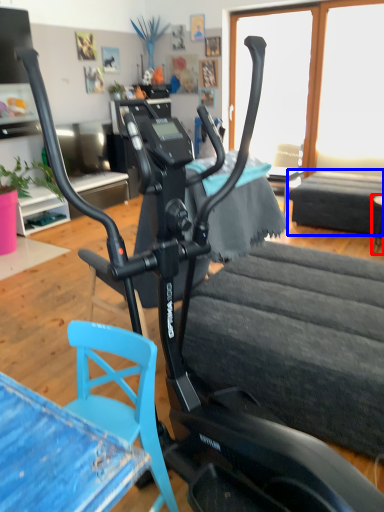
Question: Which point is closer to the camera, table (highlighted by a red box) or table (highlighted by a blue box)?

Choices:
 (A) table
 (B) table

Answer: (A)